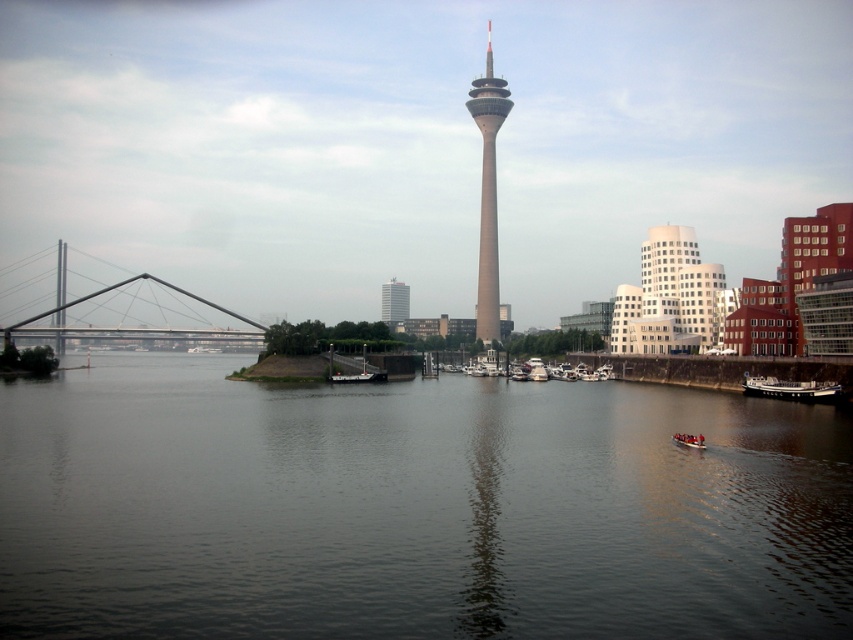
Which is more to the left, black matte boat at center or wooden boat at center?

wooden boat at center is more to the left.

Can you confirm if black matte boat at center is positioned to the right of wooden boat at center?

Correct, you'll find black matte boat at center to the right of wooden boat at center.

Does point (376, 369) lie in front of point (339, 376)?

That is False.

The image size is (853, 640). I want to click on black matte boat at center, so click(351, 372).

Is the position of metallic gray bridge at left more distant than that of metallic silver boat at lower right?

Yes, it is behind metallic silver boat at lower right.

Does metallic gray bridge at left have a greater width compared to metallic silver boat at lower right?

Yes.

The height and width of the screenshot is (640, 853). Identify the location of metallic gray bridge at left. (114, 289).

Between point (801, 396) and point (363, 378), which one is positioned behind?

The point (363, 378) is behind.

Does dark gray metallic boat at lower right come in front of wooden boat at center?

Yes, it is.

Where is `dark gray metallic boat at lower right`? The image size is (853, 640). dark gray metallic boat at lower right is located at coordinates (791, 388).

Where is `dark gray metallic boat at lower right`? dark gray metallic boat at lower right is located at coordinates (791, 388).